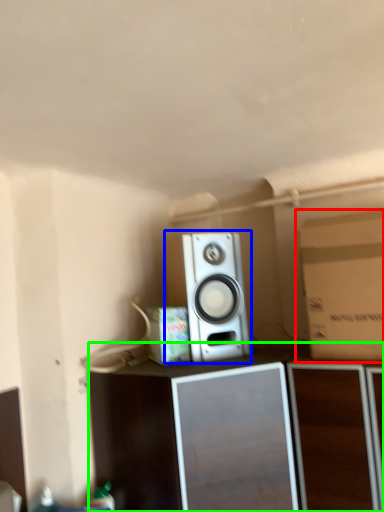
Question: Which object is the closest to the cardboard box (highlighted by a red box)? Choose among these: home appliance (highlighted by a blue box) or furniture (highlighted by a green box).

Choices:
 (A) home appliance
 (B) furniture

Answer: (B)